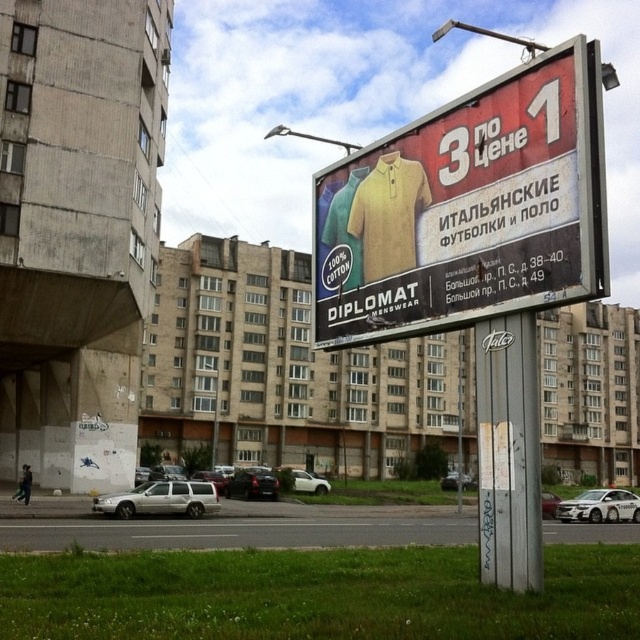
You are a delivery driver who needs to park your vehicle between the silver metallic suv at lower left and the white glossy sedan at lower right. Your vehicle is 2 meters wide. Can you fit your vehicle between them?

The silver metallic suv at lower left has a lesser width compared to white glossy sedan at lower right. Since the suv is narrower, the space between them might be sufficient, but the exact width of the space isn

You are a pedestrian standing in the middle of the street and see the silver metallic suv at lower left and the silver metallic van at center. Which vehicle is closer to you?

The silver metallic suv at lower left is positioned over the silver metallic van at center, meaning it is closer to you.